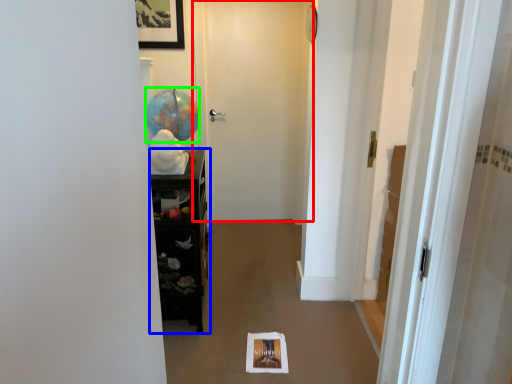
Question: Which object is the closest to the door (highlighted by a red box)? Choose among these: furniture (highlighted by a blue box) or balloon (highlighted by a green box).

Choices:
 (A) furniture
 (B) balloon

Answer: (B)